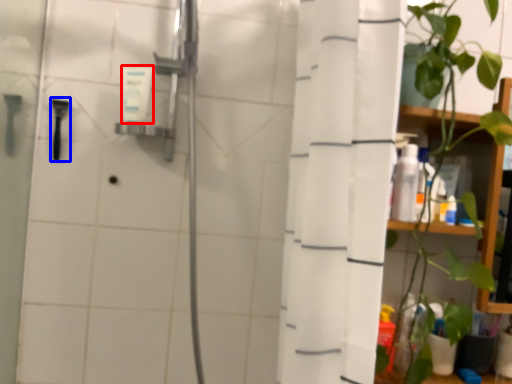
Question: Which object appears closest to the camera in this image, toiletry (highlighted by a red box) or shower (highlighted by a blue box)?

Choices:
 (A) toiletry
 (B) shower

Answer: (A)